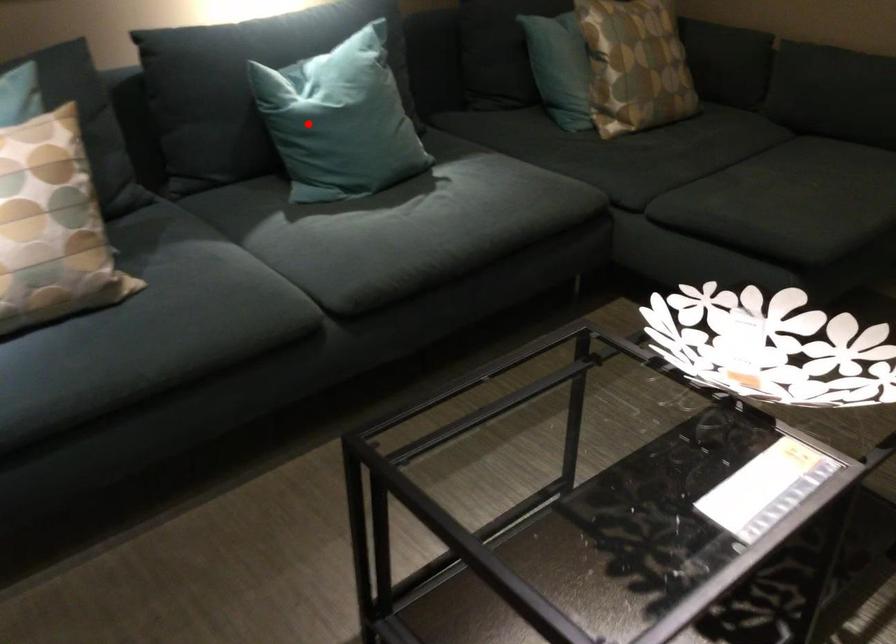
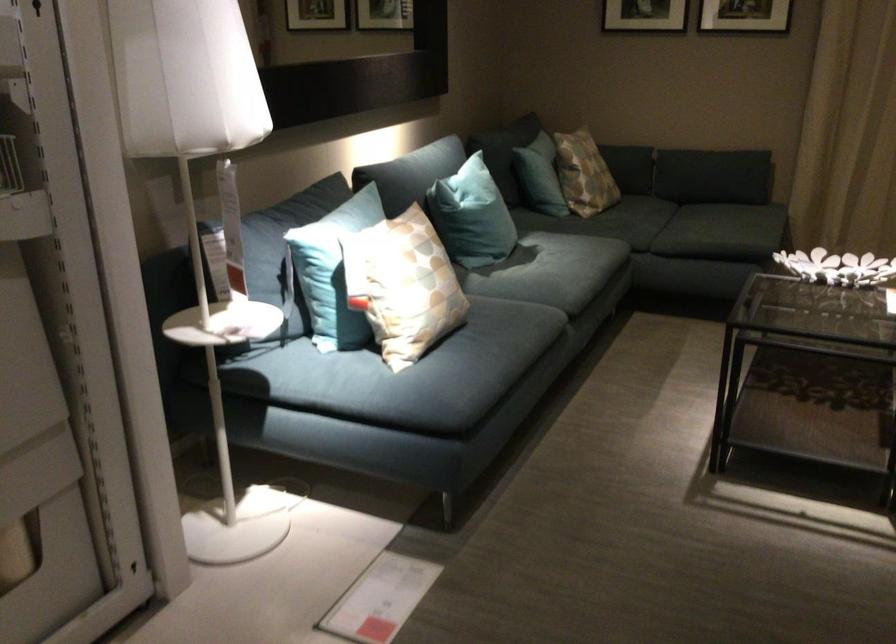
Question: A red point is marked in image1. In image2, is the corresponding 3D point closer to the camera or farther? Reply with the corresponding letter.

Choices:
 (A) The corresponding 3D point is closer.
 (B) The corresponding 3D point is farther.

Answer: (B)